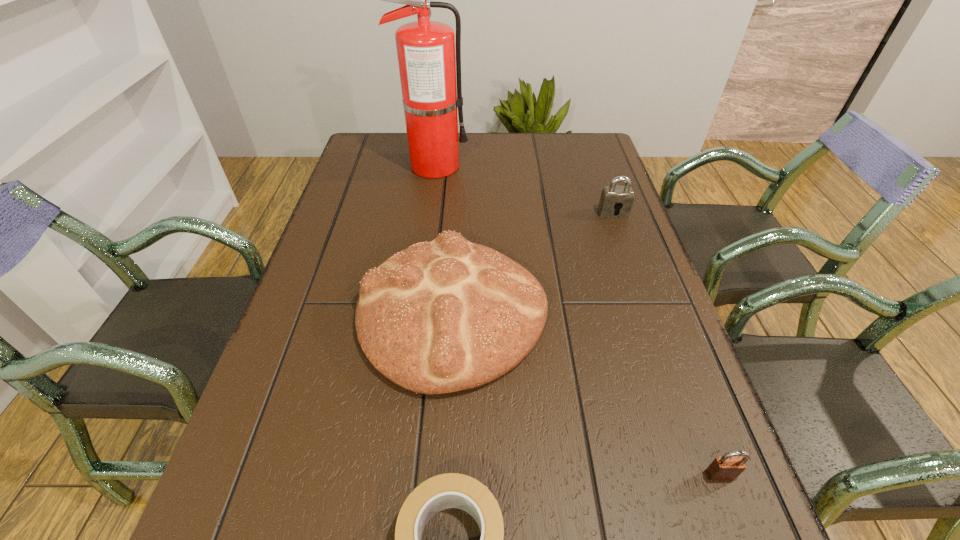
Image resolution: width=960 pixels, height=540 pixels. I want to click on vacant region between the farthest object and the taller padlock, so click(523, 190).

You are a GUI agent. You are given a task and a screenshot of the screen. Output one action in this format:
    pyautogui.click(x=<x>, y=<y>)
    Task: Click on the unoccupied position between the fourth farthest object and the fire extinguisher
    The width and height of the screenshot is (960, 540).
    Given the screenshot: What is the action you would take?
    pyautogui.click(x=577, y=320)

You are a GUI agent. You are given a task and a screenshot of the screen. Output one action in this format:
    pyautogui.click(x=<x>, y=<y>)
    Task: Click on the free space between the taller padlock and the tallest object
    
    Given the screenshot: What is the action you would take?
    pyautogui.click(x=523, y=190)

This screenshot has height=540, width=960. Find the location of `object that is the second closest to the bread`. object that is the second closest to the bread is located at coordinates pos(613,197).

The height and width of the screenshot is (540, 960). What are the coordinates of `object identified as the second closest to the farthest object` in the screenshot? It's located at (613, 197).

Locate an element on the screen. free spot that satisfies the following two spatial constraints: 1. at the nozzle of the farthest object; 2. on the right side of the third farthest object is located at coordinates (414, 314).

In order to click on vacant space that satisfies the following two spatial constraints: 1. at the nozzle of the farthest object; 2. on the right side of the third farthest object in this screenshot , I will do `click(414, 314)`.